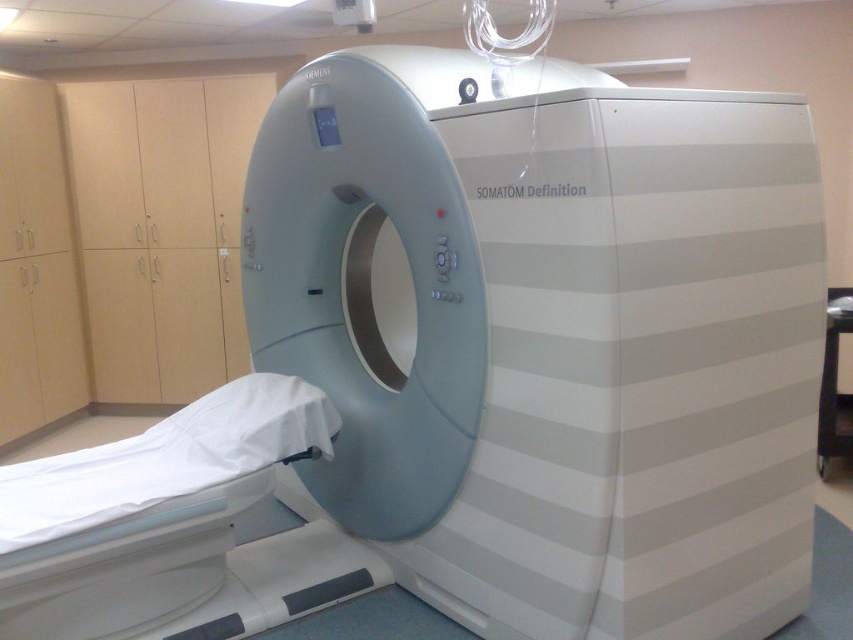
You are a nurse assisting a patient into the MRI room. The patient needs to be positioned on the bed so that their head is closest to the scanner. Based on the scene description, which direction should the patient face when lying on the white fabric bed at lower left to ensure their head is aligned with the white glossy mri scanner at center?

The patient should lie on the white fabric bed at lower left facing towards the right side, as the white glossy mri scanner at center is positioned to the right of the bed. This alignment ensures the patient can move directly toward the scanner with their head positioned correctly for imaging.

You are a medical technician preparing to position a patient on the bed for a CT scan. The patient is 1.8 meters tall. Considering the height of the white glossy mri scanner at center and the white fabric bed at lower left, will the patient be able to comfortably lie down on the bed without hitting their head on the scanner?

The white glossy mri scanner at center is much taller than the white fabric bed at lower left. Since the bed is lower, the patient can comfortably lie down without hitting their head on the scanner.

Looking at this image, you are a nurse preparing to move a patient from the bed to the scanner. The patient requires assistance due to limited mobility. Considering the distance between the white glossy mri scanner at center and the white fabric bed at lower left, can you safely transfer the patient without needing to move either the bed or the scanner?

The white glossy mri scanner at center and the white fabric bed at lower left are 29.60 inches apart from each other. This distance allows for a safe transfer of the patient without needing to move either the bed or the scanner, as 29.60 inches provides sufficient space for the nurse to maneuver and assist the patient during the transfer.